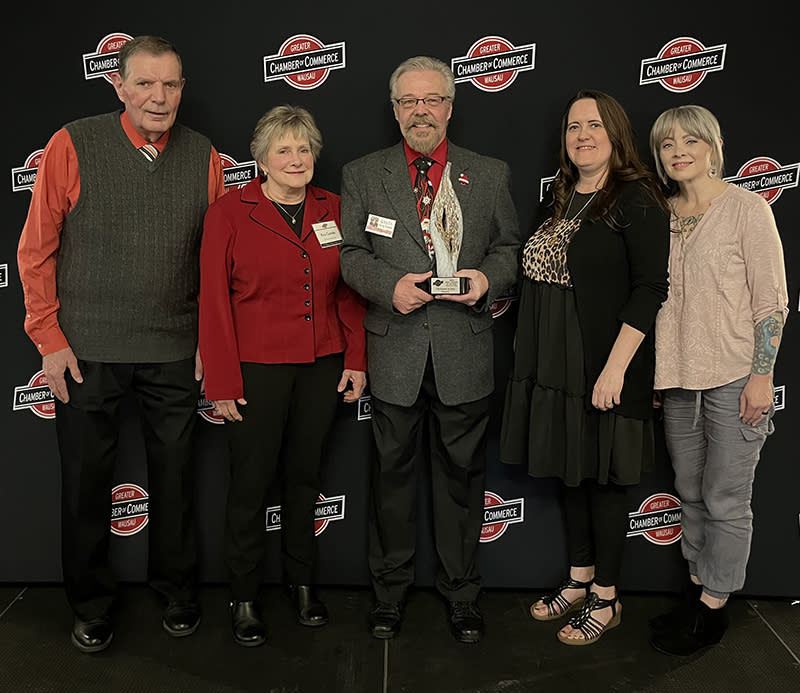
The width and height of the screenshot is (800, 693). I want to click on trophy, so click(x=442, y=245).